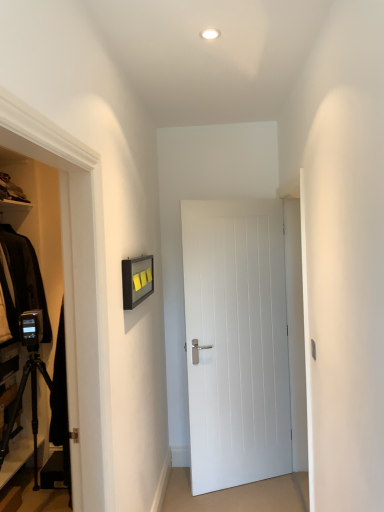
You are a GUI agent. You are given a task and a screenshot of the screen. Output one action in this format:
    pyautogui.click(x=<x>, y=<y>)
    Task: Click on the vacant space positioned to the left of white smooth door at center
    
    Given the screenshot: What is the action you would take?
    pyautogui.click(x=185, y=492)